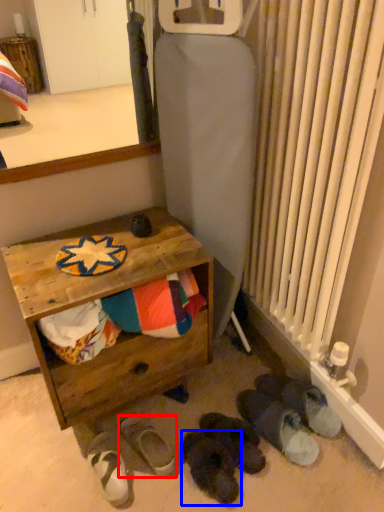
Question: Which object appears farthest to the camera in this image, footwear (highlighted by a red box) or footwear (highlighted by a blue box)?

Choices:
 (A) footwear
 (B) footwear

Answer: (A)